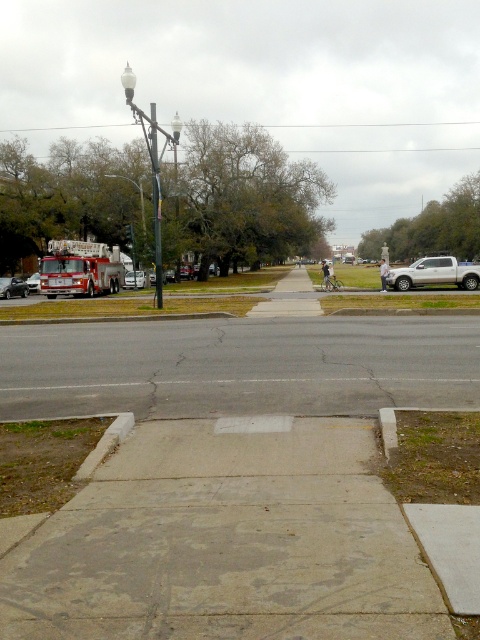
You are standing at the point labeled point (452, 259) and want to walk to the point labeled point (8, 296). Given that you can only move along the sidewalk, which direction should you face to walk towards your destination?

Since point (452, 259) is closer to the camera than point (8, 296), you should face away from the camera to walk towards the destination point (8, 296).

You are a pedestrian standing on the sidewalk. You see the silver metallic truck at right and the matte red fire truck at left. Which truck is closer to you?

The silver metallic truck at right is closer to you because it is positioned in front of the matte red fire truck at left.

You are a delivery person trying to navigate a narrow alleyway between the white glossy fire truck at left and the metallic streetlight at upper left. Can you pass through the space between them without touching either object?

The white glossy fire truck at left is larger in size than the metallic streetlight at upper left. However, the description does not provide specific measurements of the space between them, so it is unclear if there is enough room for the delivery person to pass through safely.